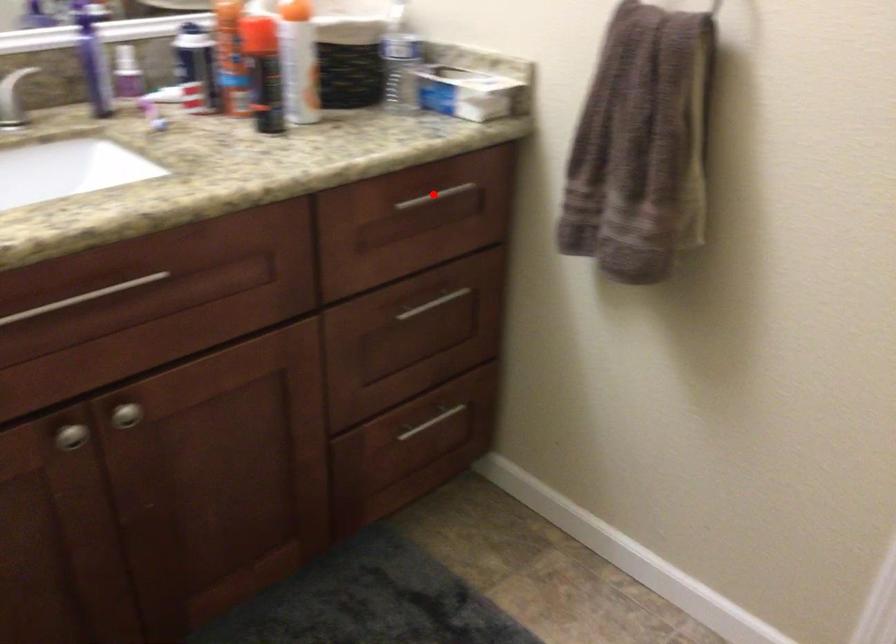
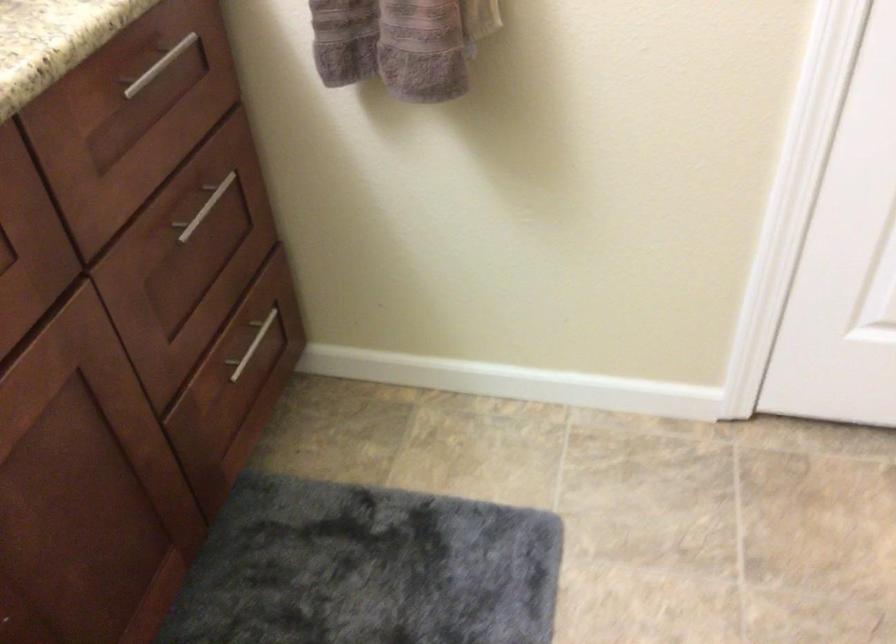
Question: I am providing you with two images of the same scene from different viewpoints. Image1 has a red point marked. In image2, the corresponding 3D location appears at what relative position? Reply with the corresponding letter.

Choices:
 (A) Closer
 (B) Farther

Answer: (A)